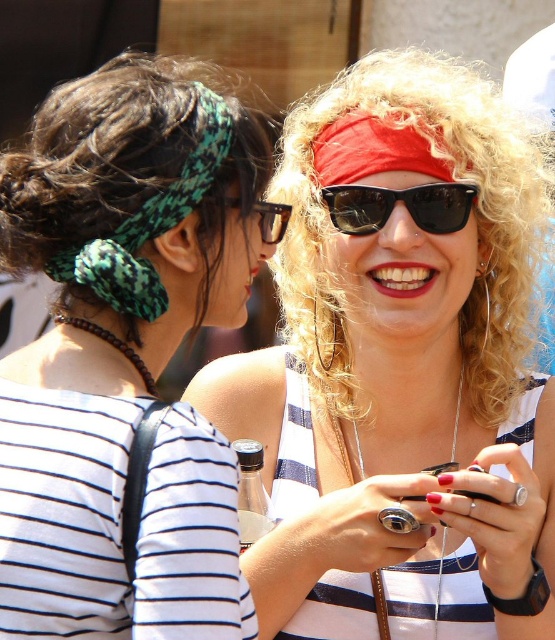
What do you see at coordinates (149, 225) in the screenshot? I see `green knitted headscarf at upper left` at bounding box center [149, 225].

Who is more distant from viewer, [117,276] or [372,202]?

The point [372,202] is more distant.

I want to click on green knitted headscarf at upper left, so click(149, 225).

Is black plastic sunglasses at center bigger than brown plastic glasses at upper center?

Yes.

Between black plastic sunglasses at center and brown plastic glasses at upper center, which one is positioned lower?

Positioned lower is brown plastic glasses at upper center.

Measure the distance between point (359, 195) and camera.

The distance of point (359, 195) from camera is 12.71 meters.

Find the location of `black plastic sunglasses at center`. black plastic sunglasses at center is located at coordinates (402, 202).

Between matte red bandana at center and black plastic sunglasses at center, which one appears on the left side from the viewer's perspective?

black plastic sunglasses at center

Is matte red bandana at center shorter than black plastic sunglasses at center?

Yes, matte red bandana at center is shorter than black plastic sunglasses at center.

You are a GUI agent. You are given a task and a screenshot of the screen. Output one action in this format:
    pyautogui.click(x=<x>, y=<y>)
    Task: Click on the matte red bandana at center
    This screenshot has height=640, width=555.
    Given the screenshot: What is the action you would take?
    pyautogui.click(x=401, y=369)

Where is `matte red bandana at center`? matte red bandana at center is located at coordinates (401, 369).